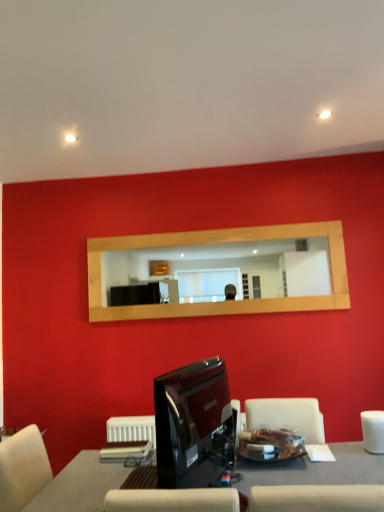
Question: From the image's perspective, is wooden mirror at center under white matte armchair at lower right?

Choices:
 (A) yes
 (B) no

Answer: (B)

Question: From the image's perspective, is wooden mirror at center on white matte armchair at lower right?

Choices:
 (A) no
 (B) yes

Answer: (B)

Question: Does wooden mirror at center have a lesser height compared to white matte armchair at lower right?

Choices:
 (A) yes
 (B) no

Answer: (B)

Question: Is wooden mirror at center positioned beyond the bounds of white matte armchair at lower right?

Choices:
 (A) no
 (B) yes

Answer: (B)

Question: Is white matte armchair at lower right at the back of wooden mirror at center?

Choices:
 (A) no
 (B) yes

Answer: (A)

Question: From the image's perspective, is smooth gray table at center above or below glossy black monitor at lower center?

Choices:
 (A) above
 (B) below

Answer: (B)

Question: Considering the positions of smooth gray table at center and glossy black monitor at lower center in the image, is smooth gray table at center wider or thinner than glossy black monitor at lower center?

Choices:
 (A) wide
 (B) thin

Answer: (A)

Question: Would you say smooth gray table at center is to the left or to the right of glossy black monitor at lower center in the picture?

Choices:
 (A) left
 (B) right

Answer: (B)

Question: Considering the positions of point (382, 478) and point (205, 367), is point (382, 478) closer or farther from the camera than point (205, 367)?

Choices:
 (A) farther
 (B) closer

Answer: (B)

Question: Considering the positions of white matte armchair at lower right and wooden mirror at center in the image, is white matte armchair at lower right wider or thinner than wooden mirror at center?

Choices:
 (A) thin
 (B) wide

Answer: (B)

Question: Looking at the image, does white matte armchair at lower right seem bigger or smaller compared to wooden mirror at center?

Choices:
 (A) big
 (B) small

Answer: (B)

Question: Is white matte armchair at lower right inside or outside of wooden mirror at center?

Choices:
 (A) inside
 (B) outside

Answer: (B)

Question: Does point (382, 448) appear closer or farther from the camera than point (311, 237)?

Choices:
 (A) farther
 (B) closer

Answer: (B)

Question: Is wooden mirror at center to the left or to the right of glossy black monitor at lower center in the image?

Choices:
 (A) left
 (B) right

Answer: (B)

Question: Considering the positions of wooden mirror at center and glossy black monitor at lower center in the image, is wooden mirror at center bigger or smaller than glossy black monitor at lower center?

Choices:
 (A) small
 (B) big

Answer: (B)